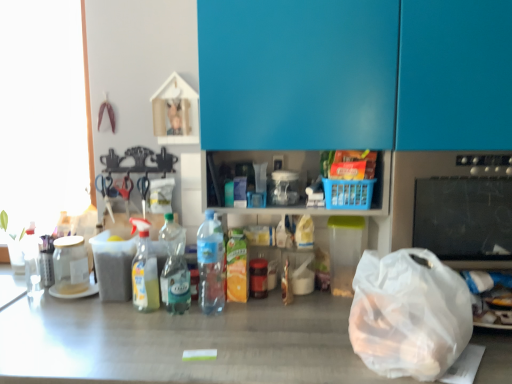
Question: Can you confirm if translucent plastic bottle at center, which ranks as the fourth bottle in left-to-right order, is thinner than transparent plastic bag at lower right?

Choices:
 (A) yes
 (B) no

Answer: (A)

Question: Considering the relative positions of translucent plastic bottle at center, arranged as the first bottle when viewed from the right, and transparent plastic bag at lower right in the image provided, is translucent plastic bottle at center, arranged as the first bottle when viewed from the right, to the right of transparent plastic bag at lower right from the viewer's perspective?

Choices:
 (A) no
 (B) yes

Answer: (A)

Question: Is translucent plastic bottle at center, which ranks as the fourth bottle in left-to-right order, shorter than transparent plastic bag at lower right?

Choices:
 (A) yes
 (B) no

Answer: (B)

Question: Would you say translucent plastic bottle at center, which ranks as the fourth bottle in left-to-right order, is outside transparent plastic bag at lower right?

Choices:
 (A) yes
 (B) no

Answer: (A)

Question: From a real-world perspective, is translucent plastic bottle at center, which ranks as the fourth bottle in left-to-right order, on top of transparent plastic bag at lower right?

Choices:
 (A) yes
 (B) no

Answer: (A)

Question: From the image's perspective, is transparent glass jar at left, the 1th bottle in the left-to-right sequence, positioned above or below blue glossy cabinet at upper center?

Choices:
 (A) above
 (B) below

Answer: (B)

Question: In terms of width, does transparent glass jar at left, the 1th bottle in the left-to-right sequence, look wider or thinner when compared to blue glossy cabinet at upper center?

Choices:
 (A) wide
 (B) thin

Answer: (B)

Question: From a real-world perspective, is transparent glass jar at left, the 1th bottle in the left-to-right sequence, positioned above or below blue glossy cabinet at upper center?

Choices:
 (A) above
 (B) below

Answer: (B)

Question: Is point (64, 246) closer or farther from the camera than point (451, 130)?

Choices:
 (A) closer
 (B) farther

Answer: (B)

Question: From a real-world perspective, is translucent plastic bottle at center, which is the third bottle in left-to-right order, physically located above or below blue glossy cabinet at upper center?

Choices:
 (A) above
 (B) below

Answer: (B)

Question: From the image's perspective, is translucent plastic bottle at center, which is the third bottle in left-to-right order, positioned above or below blue glossy cabinet at upper center?

Choices:
 (A) below
 (B) above

Answer: (A)

Question: Considering their positions, is translucent plastic bottle at center, which is the third bottle in left-to-right order, located in front of or behind blue glossy cabinet at upper center?

Choices:
 (A) behind
 (B) front

Answer: (A)

Question: Is point (172, 291) positioned closer to the camera than point (505, 130)?

Choices:
 (A) closer
 (B) farther

Answer: (B)

Question: Is point (218, 231) closer or farther from the camera than point (77, 238)?

Choices:
 (A) farther
 (B) closer

Answer: (B)

Question: In terms of size, does translucent plastic bottle at center, arranged as the first bottle when viewed from the right, appear bigger or smaller than transparent glass jar at left, the 1th bottle in the left-to-right sequence?

Choices:
 (A) small
 (B) big

Answer: (B)